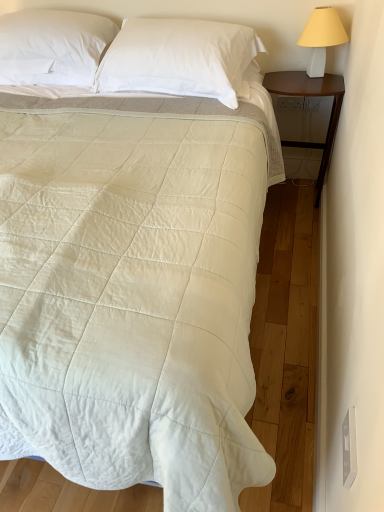
Question: Should I look upward or downward to see white smooth pillow at upper center, which ranks as the 1th pillow in right-to-left order?

Choices:
 (A) down
 (B) up

Answer: (B)

Question: Is the depth of white quilted fabric bed at center less than that of white ceramic lampshade at upper right?

Choices:
 (A) yes
 (B) no

Answer: (A)

Question: Does white quilted fabric bed at center have a greater height compared to white ceramic lampshade at upper right?

Choices:
 (A) no
 (B) yes

Answer: (B)

Question: Does white quilted fabric bed at center appear on the right side of white ceramic lampshade at upper right?

Choices:
 (A) no
 (B) yes

Answer: (A)

Question: Is white quilted fabric bed at center smaller than white ceramic lampshade at upper right?

Choices:
 (A) no
 (B) yes

Answer: (A)

Question: Is white quilted fabric bed at center directly adjacent to white ceramic lampshade at upper right?

Choices:
 (A) yes
 (B) no

Answer: (B)

Question: From a real-world perspective, is white quilted fabric bed at center beneath white ceramic lampshade at upper right?

Choices:
 (A) yes
 (B) no

Answer: (A)

Question: Could you tell me if white smooth pillow at upper center, the first pillow in the left-to-right sequence, is facing white ceramic lampshade at upper right?

Choices:
 (A) yes
 (B) no

Answer: (B)

Question: Is white smooth pillow at upper center, the first pillow in the left-to-right sequence, positioned behind white ceramic lampshade at upper right?

Choices:
 (A) yes
 (B) no

Answer: (B)

Question: Considering the relative sizes of white smooth pillow at upper center, the first pillow in the left-to-right sequence, and white ceramic lampshade at upper right in the image provided, is white smooth pillow at upper center, the first pillow in the left-to-right sequence, thinner than white ceramic lampshade at upper right?

Choices:
 (A) no
 (B) yes

Answer: (A)

Question: Is white smooth pillow at upper center, acting as the second pillow starting from the right, next to white ceramic lampshade at upper right and touching it?

Choices:
 (A) yes
 (B) no

Answer: (B)

Question: Is white smooth pillow at upper center, the first pillow in the left-to-right sequence, looking in the opposite direction of white ceramic lampshade at upper right?

Choices:
 (A) yes
 (B) no

Answer: (B)

Question: Is white smooth pillow at upper center, the first pillow in the left-to-right sequence, to the right of white ceramic lampshade at upper right from the viewer's perspective?

Choices:
 (A) yes
 (B) no

Answer: (B)

Question: Is white smooth pillow at upper center, marked as the second pillow in a left-to-right arrangement, at the right side of white quilted fabric bed at center?

Choices:
 (A) yes
 (B) no

Answer: (A)